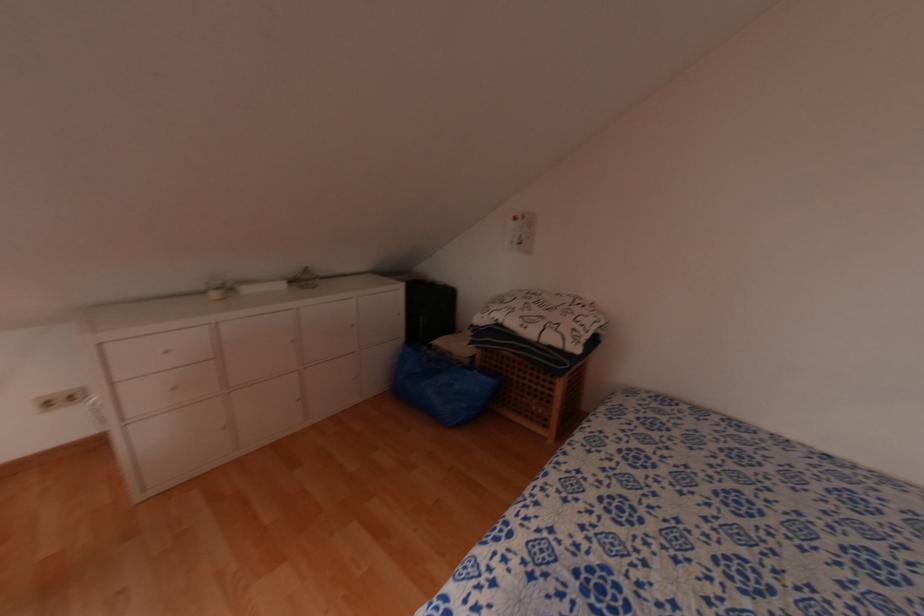
Which object does [216,290] point to?

It refers to a white candle holder.